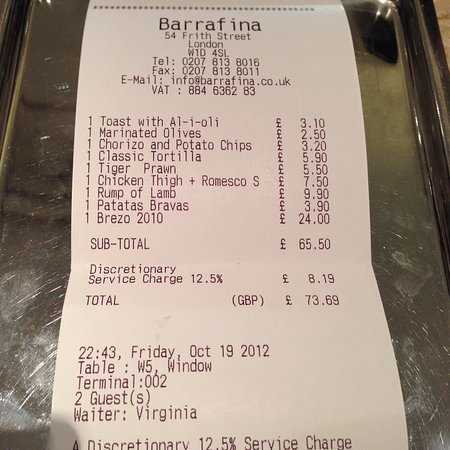
The height and width of the screenshot is (450, 450). Find the location of `rod`. rod is located at coordinates (409, 80).